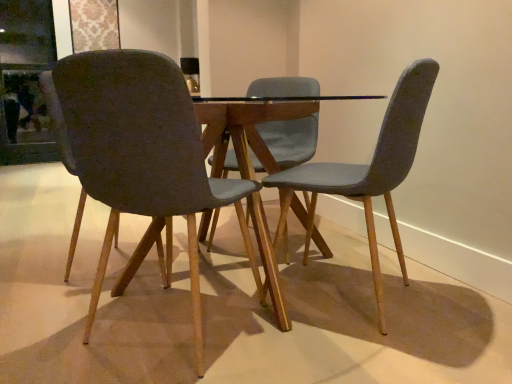
Question: Considering their positions, is transparent glass door at upper left located in front of or behind textured gray chair at center, which ranks as the 1th chair in right-to-left order?

Choices:
 (A) behind
 (B) front

Answer: (A)

Question: From the image's perspective, is transparent glass door at upper left located above or below textured gray chair at center, the second chair when ordered from left to right?

Choices:
 (A) below
 (B) above

Answer: (B)

Question: Which is farther from the textured gray chair at left, which is the 2th chair in right-to-left order?

Choices:
 (A) transparent glass door at upper left
 (B) textured gray chair at center, the second chair when ordered from left to right

Answer: (A)

Question: Considering the real-world distances, which object is closest to the transparent glass door at upper left?

Choices:
 (A) textured gray chair at left, which is the first chair from left to right
 (B) textured gray chair at center, the second chair when ordered from left to right

Answer: (A)